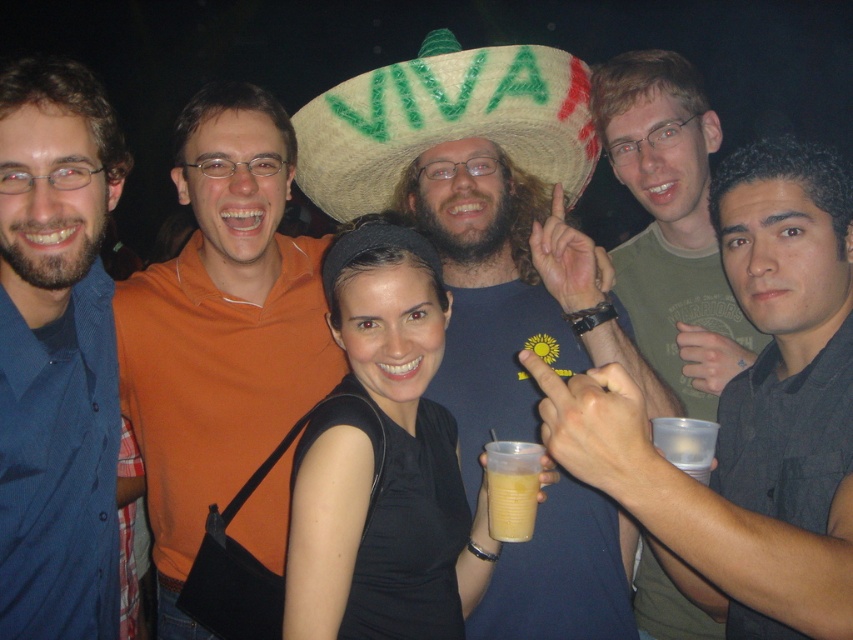
Question: Which object appears farthest from the camera in this image?

Choices:
 (A) natural straw sombrero at center
 (B) orange cotton shirt at center
 (C) yellow translucent cup at center

Answer: (B)

Question: Is blue button-down shirt at left below black matte dress at center?

Choices:
 (A) no
 (B) yes

Answer: (A)

Question: Is black matte dress at center closer to the viewer compared to yellow translucent cup at center?

Choices:
 (A) yes
 (B) no

Answer: (A)

Question: Which object is closer to the camera taking this photo?

Choices:
 (A) straw hat at center
 (B) blue button-down shirt at left
 (C) black matte dress at center
 (D) yellow translucent cup at center

Answer: (C)

Question: Is matte green t-shirt at center positioned at the back of black matte dress at center?

Choices:
 (A) no
 (B) yes

Answer: (A)

Question: Which is farther from the black matte dress at center?

Choices:
 (A) yellow translucent cup at center
 (B) blue button-down shirt at left
 (C) straw hat at center

Answer: (C)